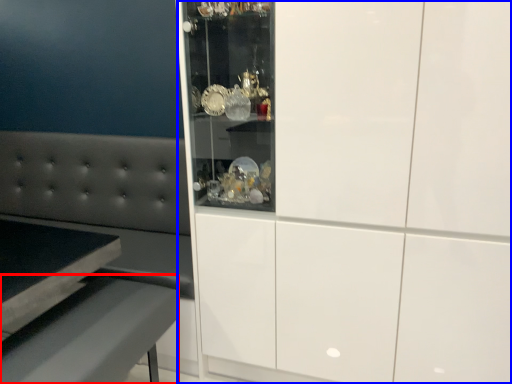
Question: Which of the following is the closest to the observer, table (highlighted by a red box) or cabinetry (highlighted by a blue box)?

Choices:
 (A) table
 (B) cabinetry

Answer: (B)